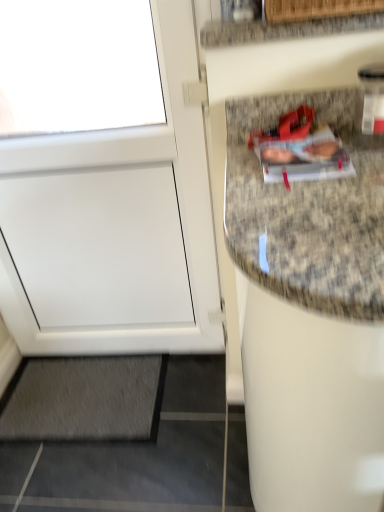
Image resolution: width=384 pixels, height=512 pixels. What are the coordinates of `free space above gray carpet at lower left (from a real-world perspective)` in the screenshot? It's located at (88, 389).